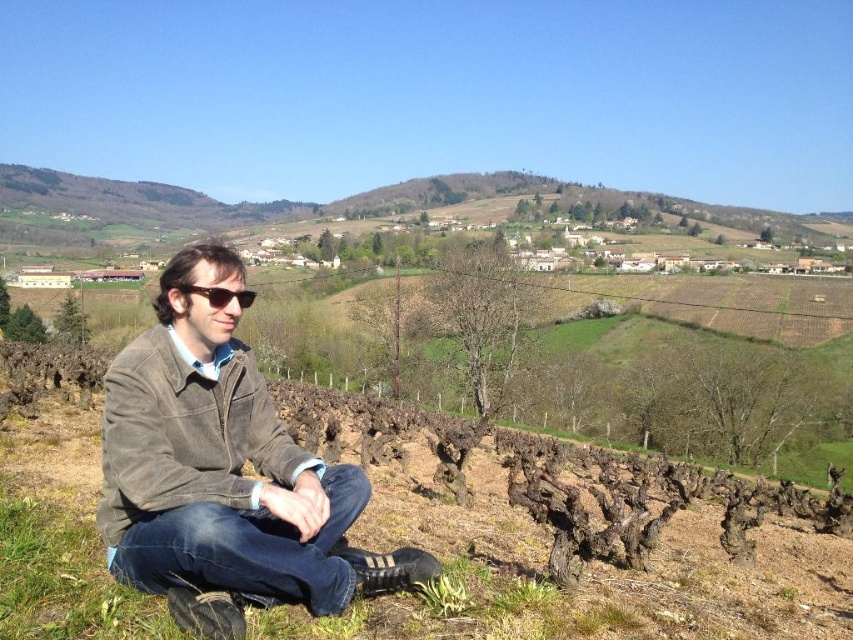
Is brown suede jacket at center to the right of brown corduroy jacket at lower left from the viewer's perspective?

No, brown suede jacket at center is not to the right of brown corduroy jacket at lower left.

Which is above, brown suede jacket at center or brown corduroy jacket at lower left?

Positioned higher is brown corduroy jacket at lower left.

Is point (204, 560) closer to camera compared to point (210, 490)?

Yes, point (204, 560) is closer to viewer.

Identify the location of brown suede jacket at center. The image size is (853, 640). (224, 472).

What do you see at coordinates (187, 433) in the screenshot? I see `brown corduroy jacket at lower left` at bounding box center [187, 433].

Which is in front, point (120, 449) or point (230, 296)?

Positioned in front is point (120, 449).

Where is `brown corduroy jacket at lower left`? The height and width of the screenshot is (640, 853). brown corduroy jacket at lower left is located at coordinates [x=187, y=433].

Based on the photo, can you confirm if brown suede jacket at center is smaller than matte black sunglasses at center?

Incorrect, brown suede jacket at center is not smaller in size than matte black sunglasses at center.

Is point (260, 502) positioned before point (212, 285)?

That is True.

Where is `brown suede jacket at center`? Image resolution: width=853 pixels, height=640 pixels. brown suede jacket at center is located at coordinates (224, 472).